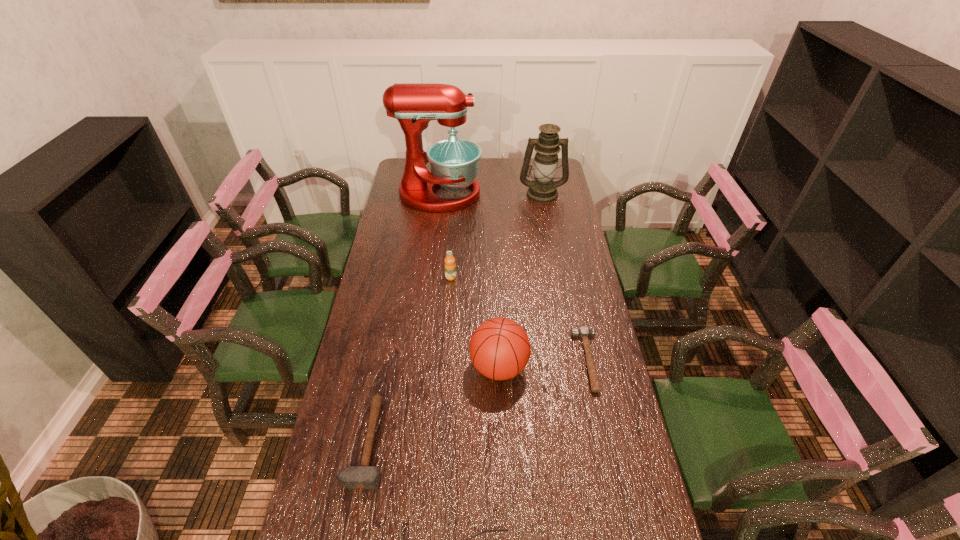
Where is `vacant space located 0.300m on the left of the sixth shortest object`? vacant space located 0.300m on the left of the sixth shortest object is located at coordinates (456, 193).

The image size is (960, 540). I want to click on vacant space located 0.390m on the front of the basketball, so click(505, 534).

Identify the location of vacant space located on the label of the orange juice. Image resolution: width=960 pixels, height=540 pixels. (444, 366).

I want to click on vacant area situated on the striking surface of the taller hammer, so click(x=479, y=443).

In order to click on free point located on the striking face of the shorter hammer in this screenshot , I will do [x=560, y=361].

Image resolution: width=960 pixels, height=540 pixels. Find the location of `vacant space located on the striking face of the shorter hammer`. vacant space located on the striking face of the shorter hammer is located at coordinates (492, 361).

At what (x,y) coordinates should I click in order to perform the action: click on free space located on the striking face of the shorter hammer. Please return your answer as a coordinate pair (x, y). Image resolution: width=960 pixels, height=540 pixels. Looking at the image, I should click on (459, 361).

Where is `object that is positioned at the far edge`? This screenshot has height=540, width=960. object that is positioned at the far edge is located at coordinates (454, 162).

This screenshot has height=540, width=960. I want to click on mixer that is at the left edge, so coord(454,162).

The image size is (960, 540). Identify the location of hammer that is at the left edge. (364, 476).